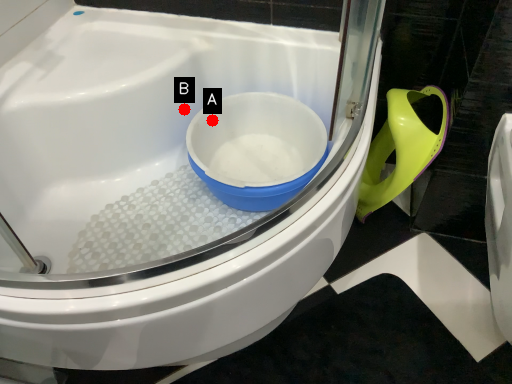
Question: Two points are circled on the image, labeled by A and B beside each circle. Which point is closer to the camera?

Choices:
 (A) A is closer
 (B) B is closer

Answer: (A)